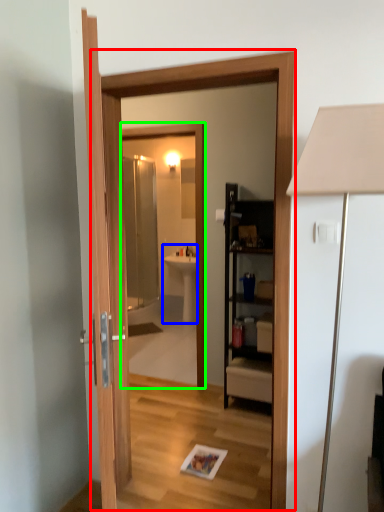
Question: Which object is positioned closest to screen door (highlighted by a red box)? Select from sink (highlighted by a blue box) and mirror (highlighted by a green box).

Choices:
 (A) sink
 (B) mirror

Answer: (B)